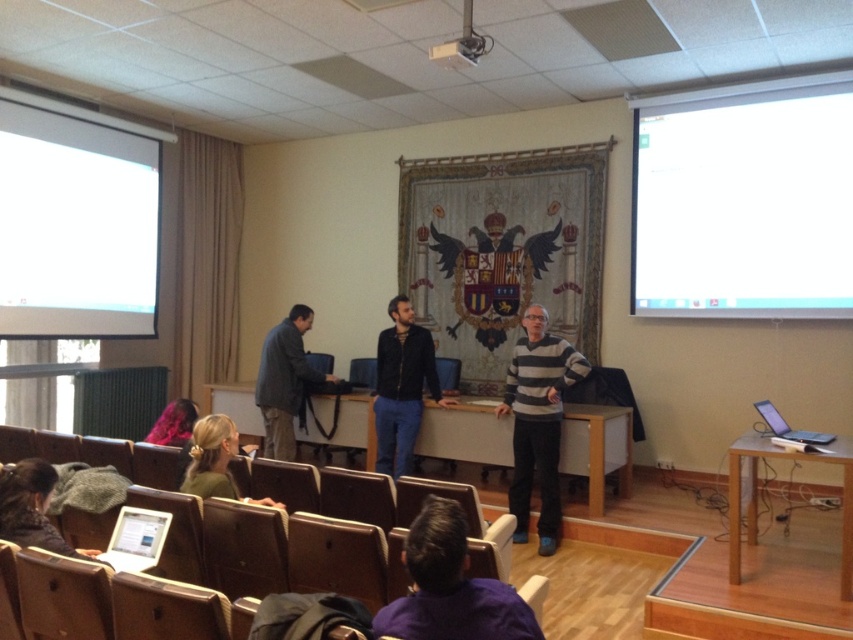
Measure the distance between point [399,416] and camera.

The distance of point [399,416] from camera is 5.20 meters.

Can you confirm if dark blue jeans at center is positioned to the right of green matte sweater at lower left?

Correct, you'll find dark blue jeans at center to the right of green matte sweater at lower left.

Locate an element on the screen. This screenshot has width=853, height=640. dark blue jeans at center is located at coordinates (402, 387).

Does white matte projection screen at upper left have a greater width compared to matte plastic chair at center?

Yes.

Can you confirm if white matte projection screen at upper left is positioned to the left of matte plastic chair at center?

Yes, white matte projection screen at upper left is to the left of matte plastic chair at center.

Consider the image. Who is more distant from viewer, (71, 228) or (351, 378)?

The point (351, 378) is behind.

Image resolution: width=853 pixels, height=640 pixels. What are the coordinates of `white matte projection screen at upper left` in the screenshot? It's located at (76, 221).

Is point (753, 310) behind point (486, 628)?

Yes, it is behind point (486, 628).

Locate an element on the screen. Image resolution: width=853 pixels, height=640 pixels. white glossy projection screen at upper right is located at coordinates (744, 205).